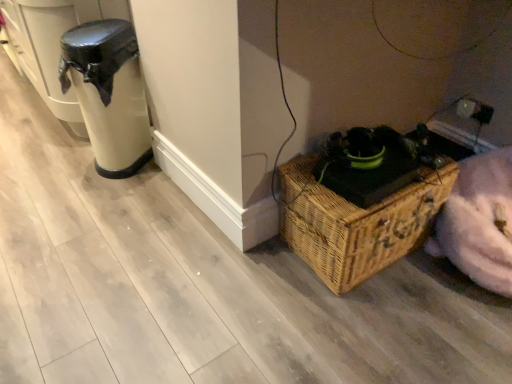
What do you see at coordinates (108, 93) in the screenshot?
I see `matte black trash can at left` at bounding box center [108, 93].

Locate an element on the screen. This screenshot has height=384, width=512. matte black trash can at left is located at coordinates (108, 93).

Locate an element on the screen. The image size is (512, 384). woven brown picnic basket at lower right is located at coordinates (357, 221).

The height and width of the screenshot is (384, 512). Describe the element at coordinates (357, 221) in the screenshot. I see `woven brown picnic basket at lower right` at that location.

This screenshot has width=512, height=384. In order to click on matte black trash can at left in this screenshot , I will do `click(108, 93)`.

Consider the image. Can you confirm if matte black trash can at left is positioned to the right of woven brown picnic basket at lower right?

In fact, matte black trash can at left is to the left of woven brown picnic basket at lower right.

Considering their positions, is matte black trash can at left located in front of or behind woven brown picnic basket at lower right?

Clearly, matte black trash can at left is behind woven brown picnic basket at lower right.

Does point (146, 139) come farther from viewer compared to point (305, 225)?

Yes, it is behind point (305, 225).

From the image's perspective, between matte black trash can at left and woven brown picnic basket at lower right, which one is located above?

matte black trash can at left.

From a real-world perspective, between matte black trash can at left and woven brown picnic basket at lower right, who is vertically higher?

matte black trash can at left is physically above.

Between matte black trash can at left and woven brown picnic basket at lower right, which one has larger width?

Wider between the two is woven brown picnic basket at lower right.

Which of these two, matte black trash can at left or woven brown picnic basket at lower right, stands taller?

With more height is matte black trash can at left.

Looking at the image, does matte black trash can at left seem bigger or smaller compared to woven brown picnic basket at lower right?

Considering their sizes, matte black trash can at left takes up less space than woven brown picnic basket at lower right.

Is matte black trash can at left outside of woven brown picnic basket at lower right?

matte black trash can at left lies outside woven brown picnic basket at lower right's area.

Is the surface of matte black trash can at left in direct contact with woven brown picnic basket at lower right?

matte black trash can at left and woven brown picnic basket at lower right are not in contact.

Is matte black trash can at left looking in the opposite direction of woven brown picnic basket at lower right?

matte black trash can at left does not have its back to woven brown picnic basket at lower right.

Measure the distance between matte black trash can at left and woven brown picnic basket at lower right.

3.58 feet.

The height and width of the screenshot is (384, 512). Identify the location of appliance located above the woven brown picnic basket at lower right (from the image's perspective). (108, 93).

Is woven brown picnic basket at lower right at the left side of matte black trash can at left?

No, woven brown picnic basket at lower right is not to the left of matte black trash can at left.

Considering the positions of objects woven brown picnic basket at lower right and matte black trash can at left in the image provided, who is in front, woven brown picnic basket at lower right or matte black trash can at left?

Positioned in front is woven brown picnic basket at lower right.

Considering the points (328, 250) and (133, 77), which point is behind, point (328, 250) or point (133, 77)?

The point (133, 77) is farther.

From the image's perspective, relative to matte black trash can at left, is woven brown picnic basket at lower right above or below?

From the image's perspective, woven brown picnic basket at lower right appears below matte black trash can at left.

From a real-world perspective, does woven brown picnic basket at lower right sit lower than matte black trash can at left?

Yes, from a real-world perspective, woven brown picnic basket at lower right is beneath matte black trash can at left.

Which object is thinner, woven brown picnic basket at lower right or matte black trash can at left?

matte black trash can at left.

Considering the sizes of woven brown picnic basket at lower right and matte black trash can at left in the image, is woven brown picnic basket at lower right taller or shorter than matte black trash can at left?

In the image, woven brown picnic basket at lower right appears to be shorter than matte black trash can at left.

Which of these two, woven brown picnic basket at lower right or matte black trash can at left, is smaller?

matte black trash can at left is smaller.

Is woven brown picnic basket at lower right not inside matte black trash can at left?

That's correct, woven brown picnic basket at lower right is outside of matte black trash can at left.

Is woven brown picnic basket at lower right with matte black trash can at left?

No, woven brown picnic basket at lower right is not beside matte black trash can at left.

Is woven brown picnic basket at lower right oriented towards matte black trash can at left?

No.

How distant is woven brown picnic basket at lower right from matte black trash can at left?

A distance of 3.58 feet exists between woven brown picnic basket at lower right and matte black trash can at left.

Locate an element on the screen. appliance above the woven brown picnic basket at lower right (from the image's perspective) is located at coordinates (108, 93).

Locate an element on the screen. The height and width of the screenshot is (384, 512). picnic basket in front of the matte black trash can at left is located at coordinates (357, 221).

Image resolution: width=512 pixels, height=384 pixels. Identify the location of appliance that is behind the woven brown picnic basket at lower right. (108, 93).